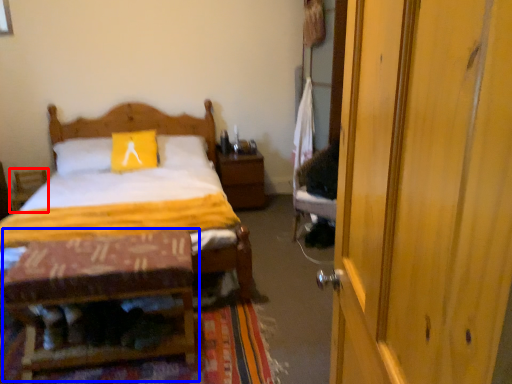
Question: Which point is closer to the camera, armchair (highlighted by a red box) or table (highlighted by a blue box)?

Choices:
 (A) armchair
 (B) table

Answer: (B)